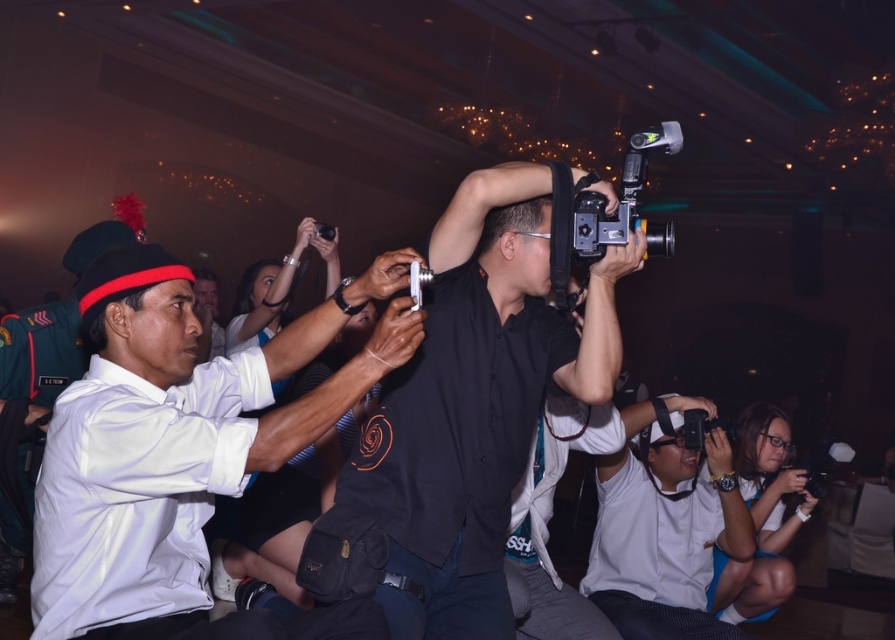
Can you confirm if black matte camera at center is smaller than black plastic video camera at upper center?

No, black matte camera at center is not smaller than black plastic video camera at upper center.

Does black matte camera at center come in front of black plastic video camera at upper center?

Yes.

The height and width of the screenshot is (640, 895). Describe the element at coordinates (476, 401) in the screenshot. I see `black matte camera at center` at that location.

This screenshot has width=895, height=640. I want to click on black matte camera at center, so (476, 401).

Is white matte uniform at center bigger than black matte camera at center?

No.

Is white matte uniform at center wider than black matte camera at center?

Yes, white matte uniform at center is wider than black matte camera at center.

Image resolution: width=895 pixels, height=640 pixels. What do you see at coordinates (180, 445) in the screenshot? I see `white matte uniform at center` at bounding box center [180, 445].

Locate an element on the screen. white matte uniform at center is located at coordinates (180, 445).

Consider the image. Is black matte camera at center above white matte shirt at center?

Yes.

Can you confirm if black matte camera at center is taller than white matte shirt at center?

Yes.

Who is more forward, (x=533, y=248) or (x=606, y=497)?

Point (x=533, y=248)

This screenshot has width=895, height=640. What are the coordinates of `black matte camera at center` in the screenshot? It's located at (476, 401).